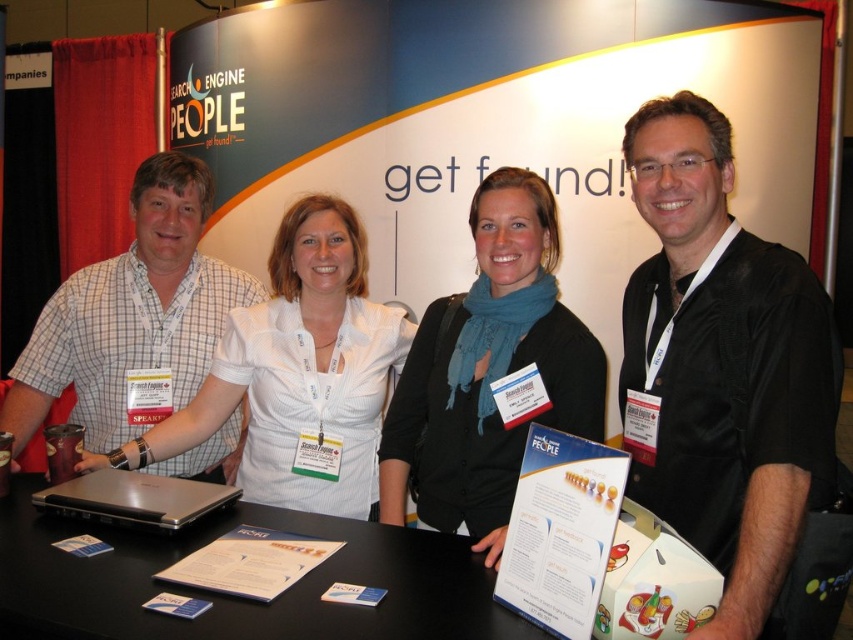
You are a photographer at the event and need to capture a clear photo of the white matte shirt at center. The camera you are using has a minimum focusing distance of 1.5 meters. Can you take the photo without moving closer than 1.5 meters?

The white matte shirt at center is 1.68 meters from the viewer, which is beyond the camera minimum focusing distance of 1.5 meters. Therefore, the photographer can take the photo without moving closer than 1.5 meters.

You are a photographer standing at the front of the scene. You need to position a light source directly above the black matte scarf at center. Based on the coordinates provided, what are the coordinates where you should place the light source?

The coordinates for placing the light source directly above the black matte scarf at center would be vertically aligned with its current position at point 0.581 on the x and 0.573 on the y. Since it needs to be directly above, the x coordinate remains the same, and the y coordinate would decrease slightly. However, without specific vertical positioning details, the base coordinates are approximately (488,371).